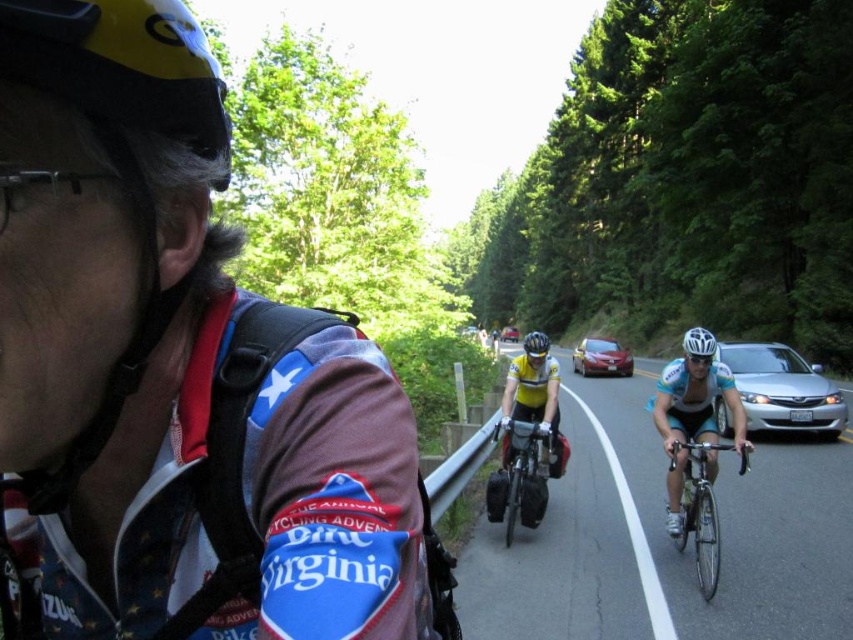
Is shiny silver bicycle at center further to camera compared to white matte bicycle helmet at center?

No, shiny silver bicycle at center is closer to the viewer.

Is point (761, 605) less distant than point (711, 349)?

Yes, point (761, 605) is in front of point (711, 349).

Image resolution: width=853 pixels, height=640 pixels. I want to click on shiny silver bicycle at center, so click(665, 540).

Who is higher up, shiny silver bicycle at center or white matte helmet at center?

white matte helmet at center

Is point (608, 536) positioned behind point (688, 356)?

Yes, it is behind point (688, 356).

You are a GUI agent. You are given a task and a screenshot of the screen. Output one action in this format:
    pyautogui.click(x=<x>, y=<y>)
    Task: Click on the shiny silver bicycle at center
    The image size is (853, 640).
    Given the screenshot: What is the action you would take?
    pyautogui.click(x=665, y=540)

Does yellow matte helmet at upper left have a greater height compared to metallic silver sedan at center?

Incorrect, yellow matte helmet at upper left's height is not larger of metallic silver sedan at center's.

Is point (173, 90) positioned before point (595, 340)?

Yes, point (173, 90) is closer to viewer.

Where is `yellow matte helmet at upper left`? yellow matte helmet at upper left is located at coordinates (117, 154).